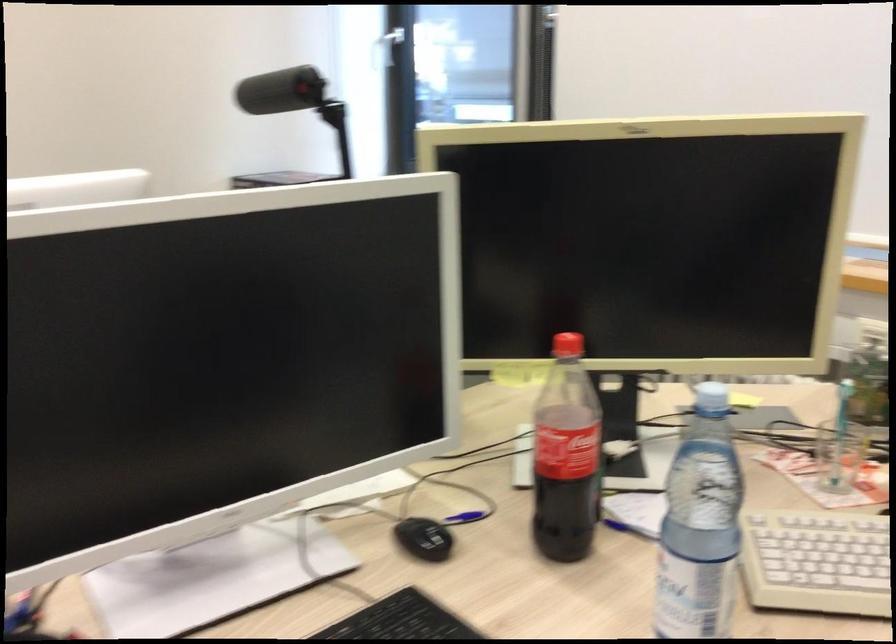
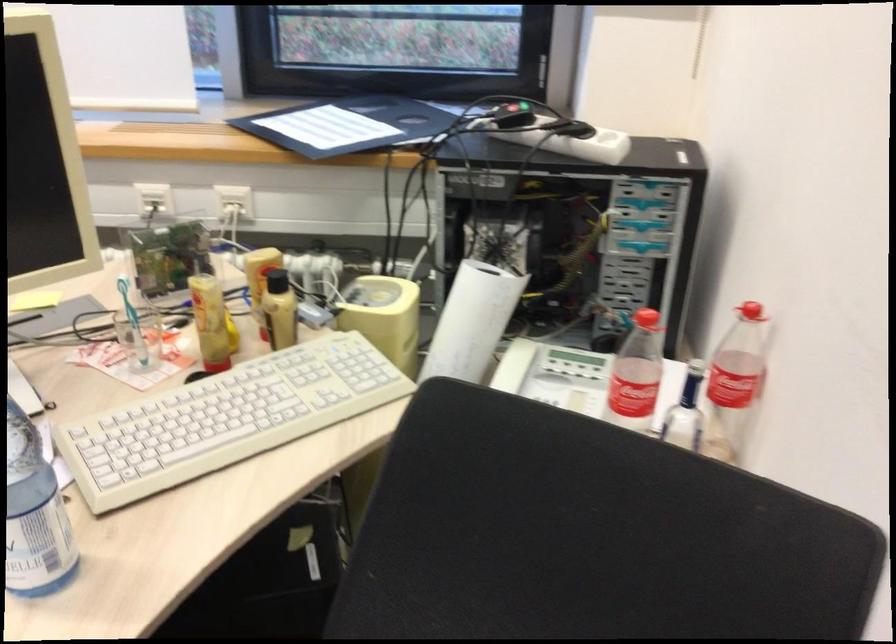
Based on the continuous images, in which direction is the camera rotating?

The camera's rotation is toward right-down.